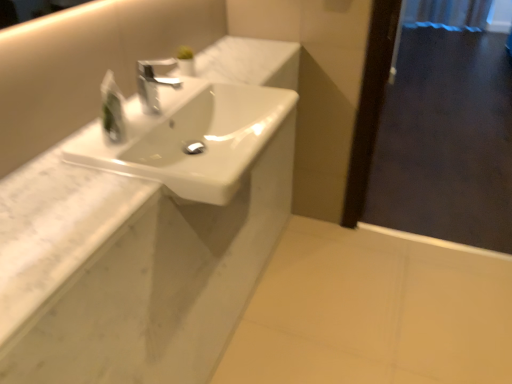
What is the approximate height of satin nickel faucet at center?

It is 5.10 inches.

What is the approximate width of white glossy sink at center?

17.63 inches.

Where is `transparent glass screen door at right`? transparent glass screen door at right is located at coordinates (446, 133).

Is white glossy sink at center far away from satin nickel faucet at center?

Actually, white glossy sink at center and satin nickel faucet at center are a little close together.

Which object is closer to the camera, white glossy sink at center or satin nickel faucet at center?

white glossy sink at center is closer to the camera.

Who is shorter, white glossy sink at center or satin nickel faucet at center?

Standing shorter between the two is satin nickel faucet at center.

Visually, is white marble counter at upper left positioned to the left or to the right of satin nickel faucet at center?

white marble counter at upper left is positioned on satin nickel faucet at center's right side.

Considering the sizes of objects white marble counter at upper left and satin nickel faucet at center in the image provided, who is thinner, white marble counter at upper left or satin nickel faucet at center?

Thinner between the two is satin nickel faucet at center.

Where is `counter below the satin nickel faucet at center (from a real-world perspective)`? Image resolution: width=512 pixels, height=384 pixels. counter below the satin nickel faucet at center (from a real-world perspective) is located at coordinates (129, 270).

Who is taller, translucent plastic soap dispenser at upper left or transparent glass screen door at right?

transparent glass screen door at right is taller.

Is translucent plastic soap dispenser at upper left smaller than transparent glass screen door at right?

Yes, translucent plastic soap dispenser at upper left is smaller than transparent glass screen door at right.

Is translucent plastic soap dispenser at upper left turned away from transparent glass screen door at right?

No, translucent plastic soap dispenser at upper left is not facing the opposite direction of transparent glass screen door at right.

From a real-world perspective, is translucent plastic soap dispenser at upper left positioned under transparent glass screen door at right based on gravity?

No, from a real-world perspective, translucent plastic soap dispenser at upper left is not beneath transparent glass screen door at right.

Where is `tap on the left of the transparent glass screen door at right`? The image size is (512, 384). tap on the left of the transparent glass screen door at right is located at coordinates (153, 84).

Considering the positions of point (139, 66) and point (476, 124), is point (139, 66) closer or farther from the camera than point (476, 124)?

Point (139, 66) is positioned closer to the camera compared to point (476, 124).

Is satin nickel faucet at center oriented towards transparent glass screen door at right?

No, satin nickel faucet at center is not facing towards transparent glass screen door at right.

Can you confirm if white marble counter at upper left is wider than white glossy sink at center?

In fact, white marble counter at upper left might be narrower than white glossy sink at center.

I want to click on counter on the left side of white glossy sink at center, so click(x=129, y=270).

Does white marble counter at upper left turn towards white glossy sink at center?

Yes, white marble counter at upper left is aimed at white glossy sink at center.

Is white glossy sink at center located outside translucent plastic soap dispenser at upper left?

white glossy sink at center is positioned outside translucent plastic soap dispenser at upper left.

Does white glossy sink at center lie in front of translucent plastic soap dispenser at upper left?

Yes.

Does white glossy sink at center touch translucent plastic soap dispenser at upper left?

white glossy sink at center and translucent plastic soap dispenser at upper left are clearly separated.

Which is in front, point (223, 194) or point (112, 95)?

Point (223, 194)

Is white glossy sink at center spatially inside transparent glass screen door at right, or outside of it?

white glossy sink at center is not inside transparent glass screen door at right, it's outside.

In the image, is white glossy sink at center positioned in front of or behind transparent glass screen door at right?

Clearly, white glossy sink at center is in front of transparent glass screen door at right.

The image size is (512, 384). I want to click on sink below the transparent glass screen door at right (from the image's perspective), so click(x=190, y=137).

From a real-world perspective, is white glossy sink at center positioned under transparent glass screen door at right based on gravity?

No.

The height and width of the screenshot is (384, 512). I want to click on sink below the satin nickel faucet at center (from a real-world perspective), so click(x=190, y=137).

The width and height of the screenshot is (512, 384). Identify the location of tap to the left of white marble counter at upper left. point(153,84).

Looking at the image, which one is located further to white glossy sink at center, satin nickel faucet at center or translucent plastic soap dispenser at upper left?

Based on the image, translucent plastic soap dispenser at upper left appears to be further to white glossy sink at center.

Considering their positions, is transparent glass screen door at right positioned further to translucent plastic soap dispenser at upper left than white marble counter at upper left?

transparent glass screen door at right.

Based on their spatial positions, is white marble counter at upper left or white glossy sink at center further from transparent glass screen door at right?

white marble counter at upper left is further to transparent glass screen door at right.

In the scene shown: Based on their spatial positions, is white marble counter at upper left or white glossy sink at center closer to satin nickel faucet at center?

white glossy sink at center lies closer to satin nickel faucet at center than the other object.

Looking at the image, which one is located further to transparent glass screen door at right, satin nickel faucet at center or white glossy sink at center?

The object further to transparent glass screen door at right is satin nickel faucet at center.

Which object lies further to the anchor point satin nickel faucet at center, white marble counter at upper left or translucent plastic soap dispenser at upper left?

The object further to satin nickel faucet at center is white marble counter at upper left.

From the image, which object appears to be farther from translucent plastic soap dispenser at upper left, satin nickel faucet at center or white marble counter at upper left?

white marble counter at upper left is further to translucent plastic soap dispenser at upper left.

Consider the image. Based on their spatial positions, is white glossy sink at center or translucent plastic soap dispenser at upper left closer to white marble counter at upper left?

The object closer to white marble counter at upper left is white glossy sink at center.

This screenshot has width=512, height=384. Identify the location of tap situated between translucent plastic soap dispenser at upper left and transparent glass screen door at right from left to right. (153, 84).

At what (x,y) coordinates should I click in order to perform the action: click on sink located between satin nickel faucet at center and transparent glass screen door at right in the left-right direction. Please return your answer as a coordinate pair (x, y). The height and width of the screenshot is (384, 512). Looking at the image, I should click on (190, 137).

This screenshot has height=384, width=512. In order to click on sink between white marble counter at upper left and transparent glass screen door at right in this screenshot , I will do `click(190, 137)`.

Find the location of a particular element. counter located between satin nickel faucet at center and transparent glass screen door at right in the left-right direction is located at coordinates (129, 270).